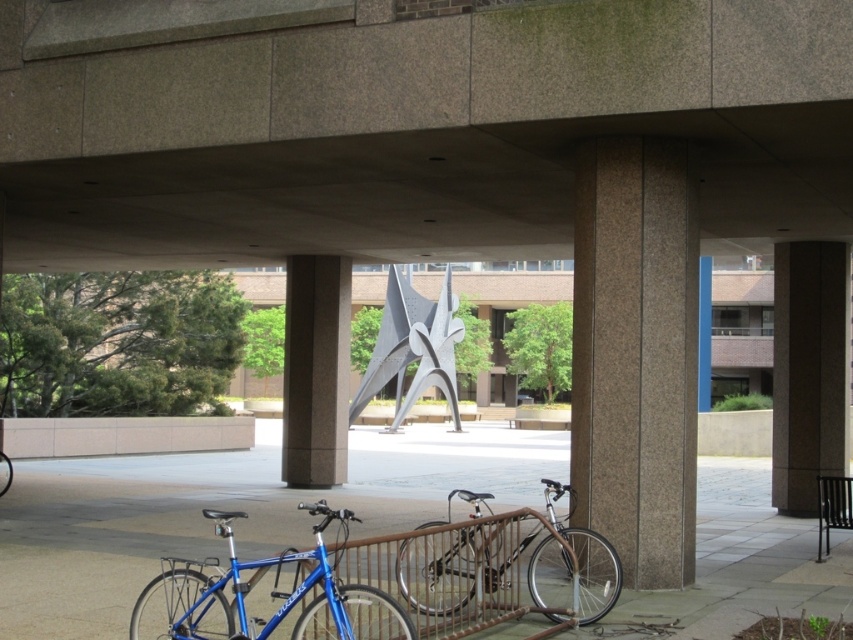
You are a delivery person needing to move a 30 feet long ladder from the brown textured pillar at right to the matte blue bicycle at lower left. Can you move the ladder horizontally without tilting it? Explain your reasoning.

The distance between the brown textured pillar at right and the matte blue bicycle at lower left is 36.36 feet. Since the ladder is 30 feet long, which is shorter than the distance between them, you can move the ladder horizontally without tilting it.

You are planning to sit on the black metal park bench at lower right while keeping an eye on your blue metallic bicycle at lower left. Since you want to ensure you can see the entire bicycle from where you sit, does the bench provide enough space for you to do so?

The black metal park bench at lower right is narrower than the blue metallic bicycle at lower left. Since the bench is shorter in width, you might not be able to see the entire bicycle from its position.

You are a person carrying a heavy backpack and need to sit down. You see the black metal park bench at lower right and the blue metallic bicycle at lower left. Which one is smaller and more suitable for sitting?

The black metal park bench at lower right has a smaller size compared to the blue metallic bicycle at lower left, so it is more suitable for sitting.